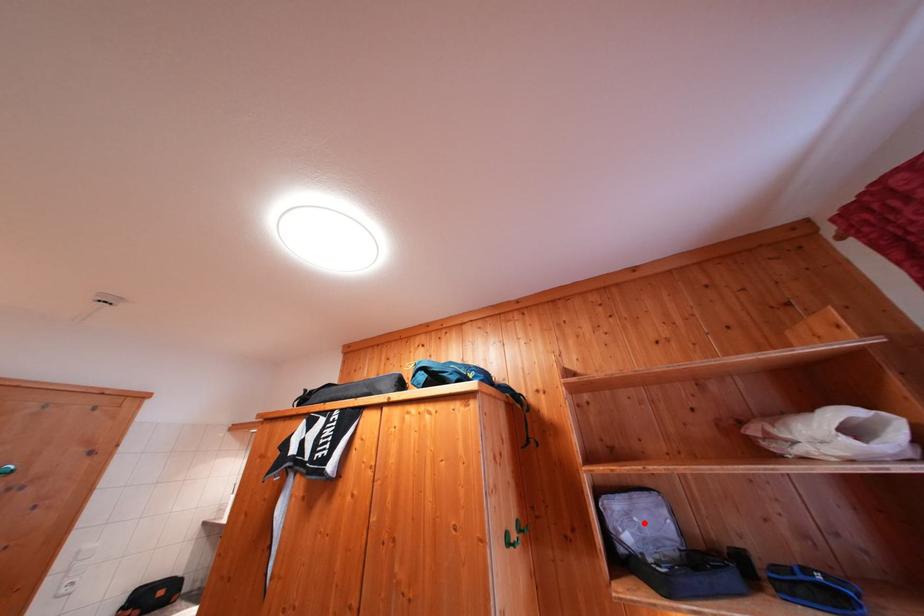
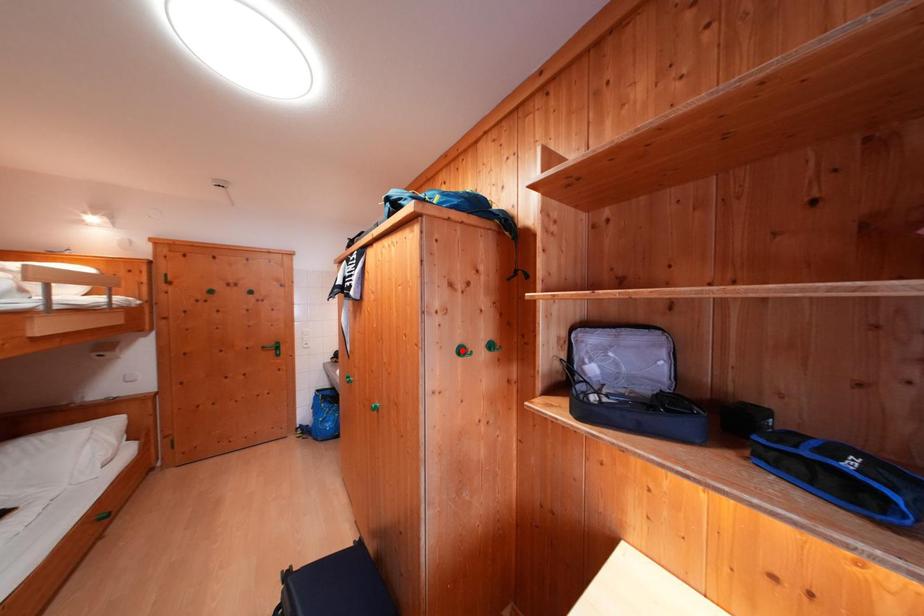
I am providing you with two images of the same scene from different viewpoints. A red point is marked on the first image and another point is marked on the second image. Is the marked point in image1 the same physical position as the marked point in image2?

No